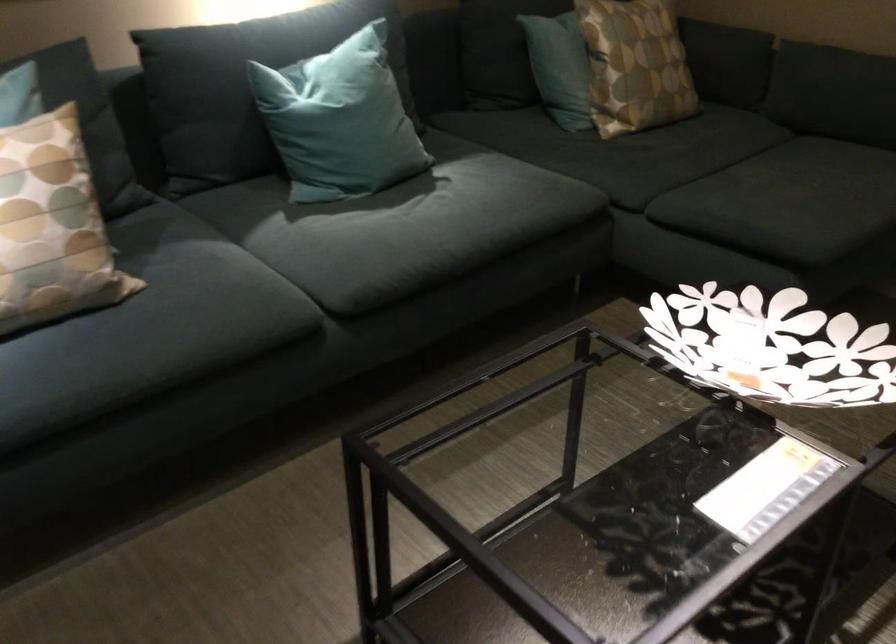
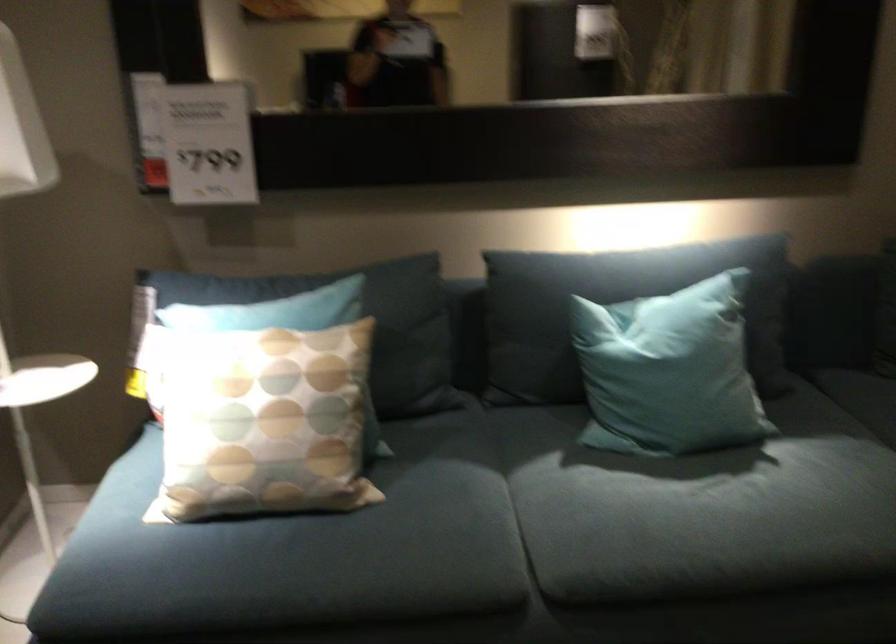
Find the pixel in the second image that matches (x=197, y=295) in the first image.

(406, 526)